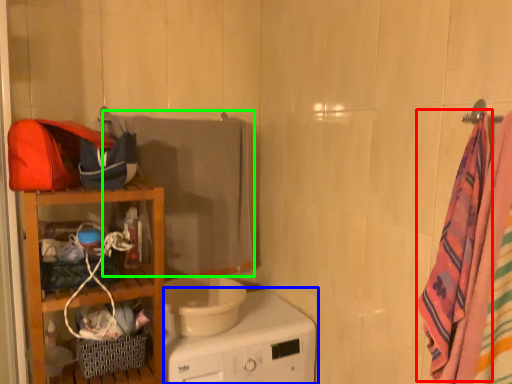
Question: Which object is the farthest from beach towel (highlighted by a red box)? Choose among these: home appliance (highlighted by a blue box) or beach towel (highlighted by a green box).

Choices:
 (A) home appliance
 (B) beach towel

Answer: (B)